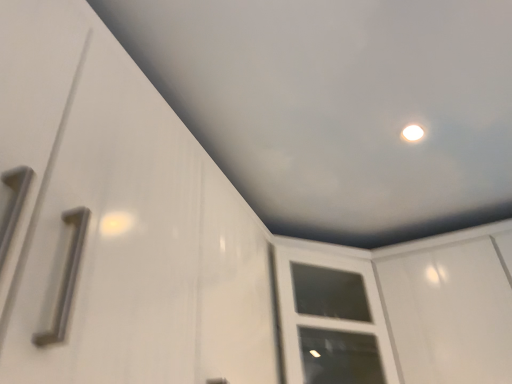
Question: From a real-world perspective, is white glossy screen door at upper right above or below white glossy cabinet door at center?

Choices:
 (A) below
 (B) above

Answer: (A)

Question: Relative to white glossy cabinet door at center, is white glossy screen door at upper right in front or behind?

Choices:
 (A) front
 (B) behind

Answer: (A)

Question: From the image's perspective, is white glossy screen door at upper right above or below white glossy cabinet door at center?

Choices:
 (A) below
 (B) above

Answer: (B)

Question: From the image's perspective, is white glossy cabinet door at center located above or below white glossy screen door at upper right?

Choices:
 (A) above
 (B) below

Answer: (B)

Question: Considering the positions of point (322, 264) and point (408, 334), is point (322, 264) closer or farther from the camera than point (408, 334)?

Choices:
 (A) closer
 (B) farther

Answer: (B)

Question: Is white glossy cabinet door at center to the left or to the right of white glossy screen door at upper right in the image?

Choices:
 (A) right
 (B) left

Answer: (B)

Question: In terms of size, does white glossy cabinet door at center appear bigger or smaller than white glossy screen door at upper right?

Choices:
 (A) small
 (B) big

Answer: (B)